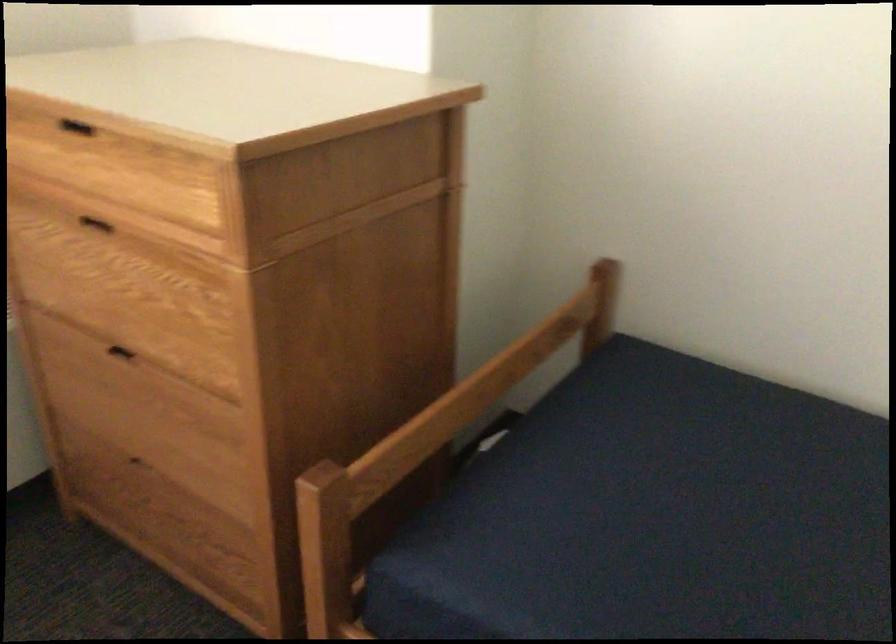
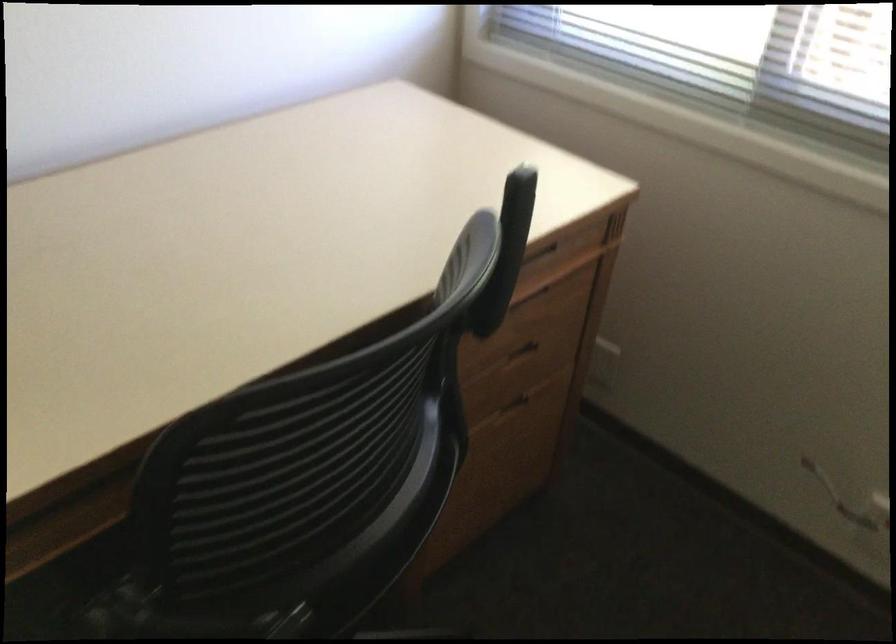
Based on the continuous images, in which direction is the camera rotating?

The camera's rotation is toward left-down.